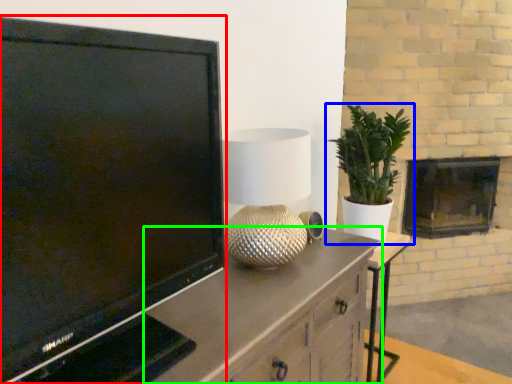
Question: Considering the real-world distances, which object is closest to television (highlighted by a red box)? houseplant (highlighted by a blue box) or cabinetry (highlighted by a green box).

Choices:
 (A) houseplant
 (B) cabinetry

Answer: (B)